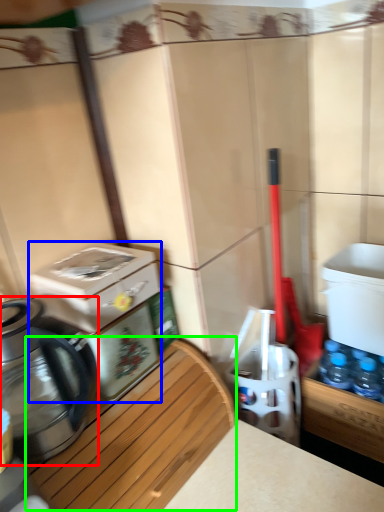
Question: Estimate the real-world distances between objects in this image. Which object is closer to kettle (highlighted by a red box), water cooler (highlighted by a blue box) or wood (highlighted by a green box)?

Choices:
 (A) water cooler
 (B) wood

Answer: (A)